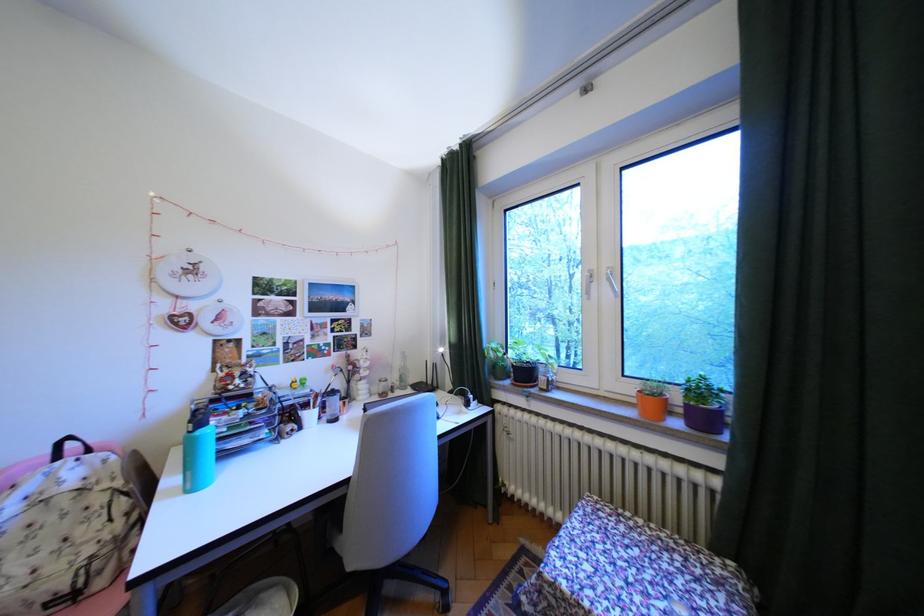
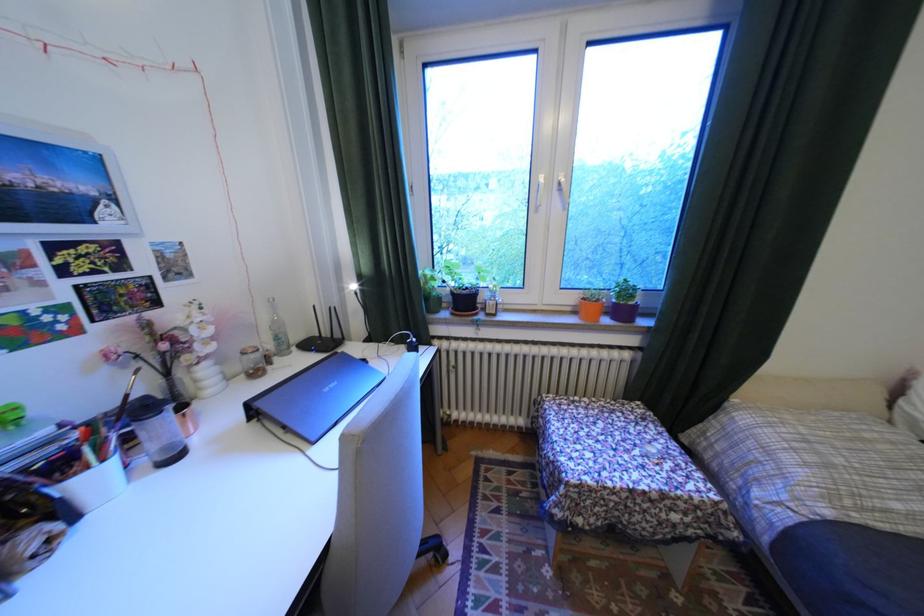
Where in the second image is the point corresponding to the point at 322,415 from the first image?

(106, 479)